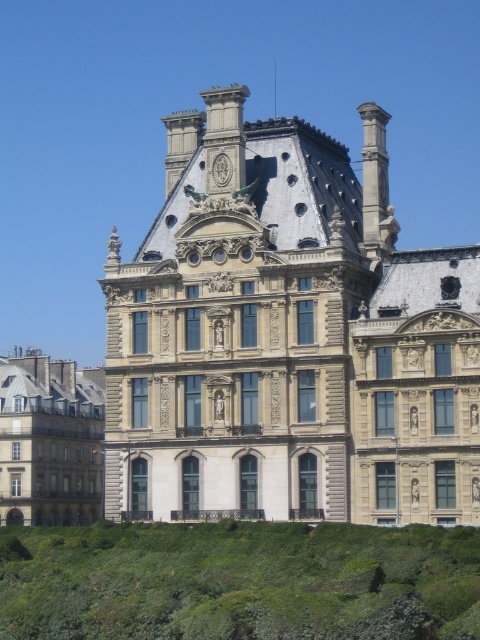
Can you confirm if beige stone building at center is shorter than green grass at lower left?

No.

Is beige stone building at center below green grass at lower left?

No, beige stone building at center is not below green grass at lower left.

Between point (173, 289) and point (247, 627), which one is positioned behind?

The point (173, 289) is more distant.

At what (x,y) coordinates should I click in order to perform the action: click on beige stone building at center. Please return your answer as a coordinate pair (x, y). The image size is (480, 640). Looking at the image, I should click on (288, 337).

Which is below, beige stone building at center or matte stone building at left?

matte stone building at left

Is point (377, 129) closer to viewer compared to point (79, 520)?

Yes.

Find the location of a particular element. This screenshot has width=480, height=640. beige stone building at center is located at coordinates (288, 337).

Is the position of green grass at lower left less distant than that of matte stone building at left?

Yes, it is.

Consider the image. Is green grass at lower left to the left of matte stone building at left from the viewer's perspective?

Incorrect, green grass at lower left is not on the left side of matte stone building at left.

Where is `green grass at lower left`? The width and height of the screenshot is (480, 640). green grass at lower left is located at coordinates (239, 580).

The image size is (480, 640). I want to click on green grass at lower left, so click(239, 580).